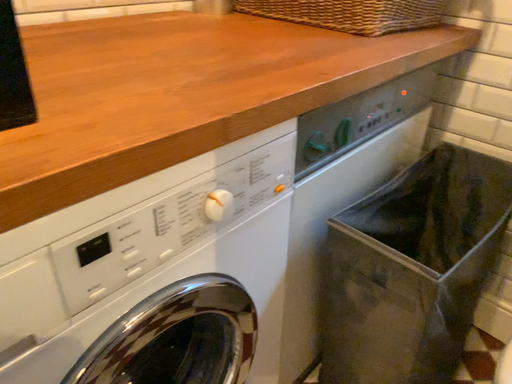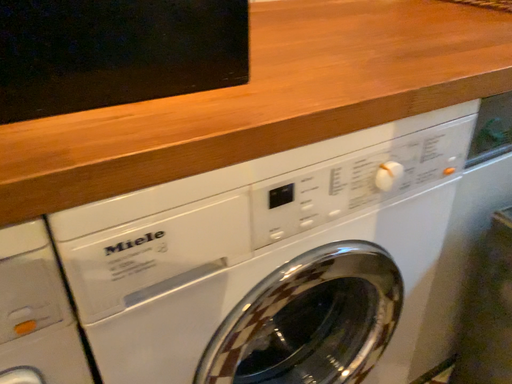
Question: How did the camera likely rotate when shooting the video?

Choices:
 (A) rotated left
 (B) rotated right

Answer: (A)